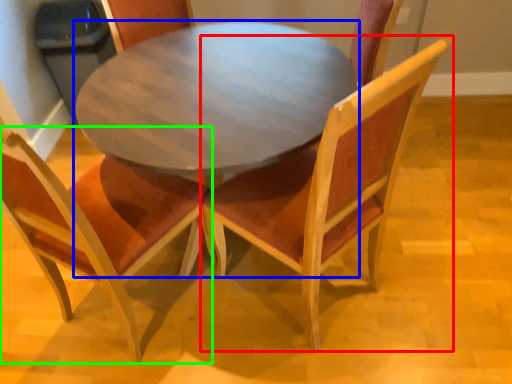
Question: Considering the real-world distances, which object is farthest from chair (highlighted by a red box)? coffee table (highlighted by a blue box) or chair (highlighted by a green box)?

Choices:
 (A) coffee table
 (B) chair

Answer: (B)